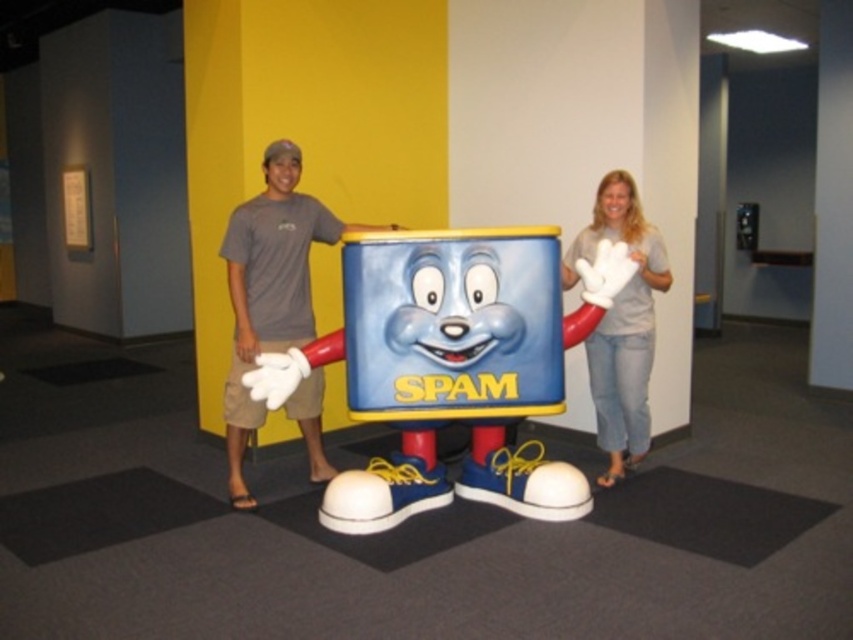
Between matte plastic spam can at center and gray cotton t-shirt at center, which one is positioned higher?

Positioned higher is gray cotton t-shirt at center.

Can you confirm if matte plastic spam can at center is smaller than gray cotton t-shirt at center?

No, matte plastic spam can at center is not smaller than gray cotton t-shirt at center.

Who is more forward, (466, 360) or (242, 284)?

Point (466, 360) is more forward.

Identify the location of matte plastic spam can at center. (451, 365).

Does gray cotton t-shirt at center have a lesser height compared to light brown denim jeans at right?

No, gray cotton t-shirt at center is not shorter than light brown denim jeans at right.

Is gray cotton t-shirt at center further to camera compared to light brown denim jeans at right?

Yes, it is behind light brown denim jeans at right.

Which is in front, point (242, 365) or point (610, 456)?

Positioned in front is point (242, 365).

The height and width of the screenshot is (640, 853). Identify the location of gray cotton t-shirt at center. (270, 288).

Between matte plastic spam can at center and light brown denim jeans at right, which one has more height?

light brown denim jeans at right

Is matte plastic spam can at center shorter than light brown denim jeans at right?

Indeed, matte plastic spam can at center has a lesser height compared to light brown denim jeans at right.

This screenshot has width=853, height=640. What are the coordinates of `matte plastic spam can at center` in the screenshot? It's located at (451, 365).